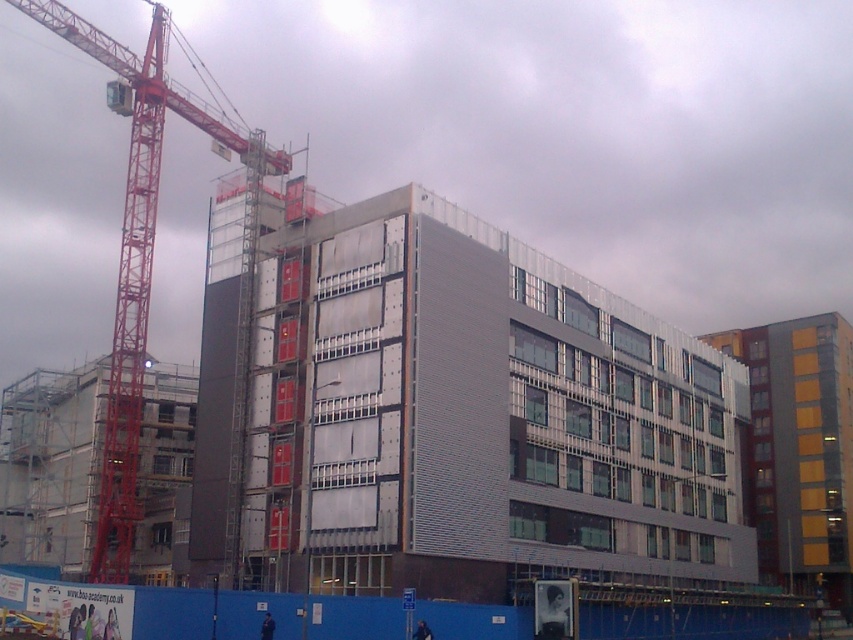
You are a construction worker standing at the blue plastic fence at lower center. You need to move to the red metal crane at left to operate it. Considering the distance between them, can you walk directly to the crane without needing to detour around the fence?

The blue plastic fence at lower center is 61.73 meters from the red metal crane at left. Since the distance is a straight line, you can walk directly to the crane without needing to detour around the fence.

You are a construction worker standing at the base of the metallic gray building at center. You need to locate the crane that is positioned to the left of the building. Based on the coordinates provided, can you determine the approximate direction to look for the crane relative to your position?

The metallic gray building at center is located at coordinates point (476,410). Since the crane is positioned to the left of the building, you should look to the left side of the building to find the crane.

You are a construction worker standing at the red metal crane at left. Looking towards the metallic gray building at center, which direction should you face to see it?

You should face to the right because the metallic gray building at center is located to the right of the red metal crane at left.